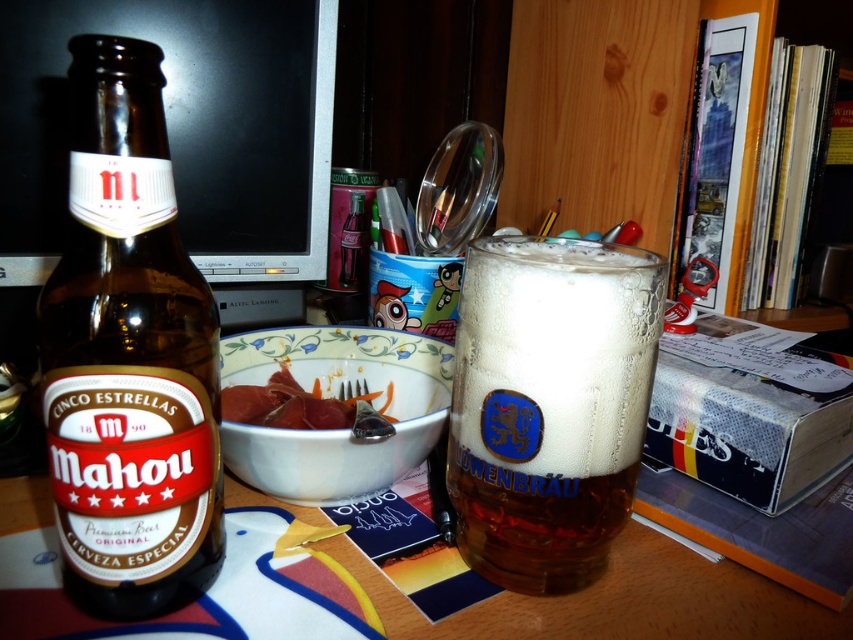
Who is more forward, (x=474, y=570) or (x=294, y=404)?

Positioned in front is point (x=474, y=570).

Is the position of translucent glass mug at center less distant than that of smooth pinkish meat at center?

Yes, it is.

Is point (485, 500) farther from viewer compared to point (270, 401)?

No, (485, 500) is closer to viewer.

Identify the location of translucent glass mug at center. pyautogui.click(x=549, y=404).

Is brown glass bottle at left further to camera compared to translucent glass mug at center?

That is False.

I want to click on brown glass bottle at left, so click(128, 353).

Locate an element on the screen. This screenshot has height=640, width=853. brown glass bottle at left is located at coordinates (128, 353).

The image size is (853, 640). Identify the location of brown glass bottle at left. (128, 353).

Between point (131, 560) and point (373, 346), which one is positioned behind?

Positioned behind is point (373, 346).

You are a GUI agent. You are given a task and a screenshot of the screen. Output one action in this format:
    pyautogui.click(x=<x>, y=<y>)
    Task: Click on the brown glass bottle at left
    The width and height of the screenshot is (853, 640).
    Given the screenshot: What is the action you would take?
    pyautogui.click(x=128, y=353)